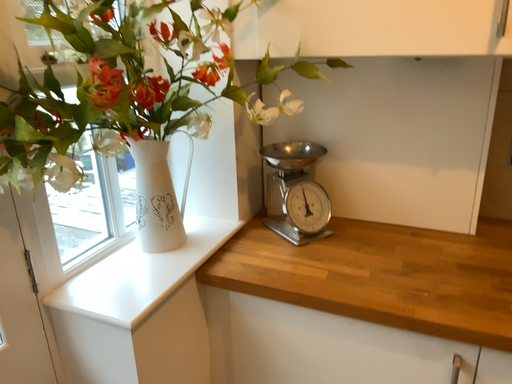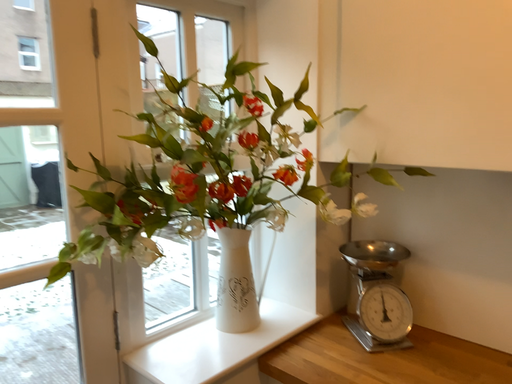
Question: Which way did the camera rotate in the video?

Choices:
 (A) rotated upward
 (B) rotated downward

Answer: (A)